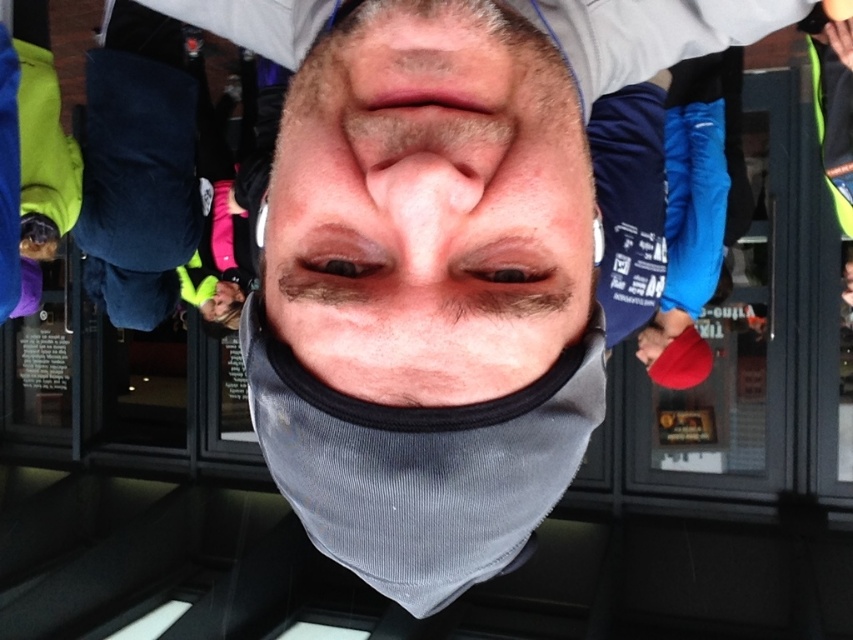
Based on the scene description, can you determine which object is wider between the gray fabric face at center and the smooth flesh nose at center?

The gray fabric face at center is wider than the smooth flesh nose at center according to the description.